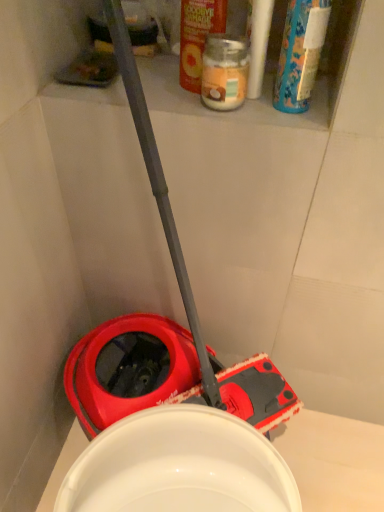
Question: From a real-world perspective, is blue plastic bottle at upper right, positioned as the second cleaning product in left-to-right order, physically located above or below orange matte jar at upper center, the 2th cleaning product viewed from the right?

Choices:
 (A) above
 (B) below

Answer: (A)

Question: Is blue plastic bottle at upper right, which is counted as the 1th cleaning product, starting from the right, situated inside orange matte jar at upper center, the 2th cleaning product viewed from the right, or outside?

Choices:
 (A) inside
 (B) outside

Answer: (B)

Question: Which of these objects is positioned farthest from the blue plastic bottle at upper right, which is counted as the 1th cleaning product, starting from the right?

Choices:
 (A) translucent glass jar at upper center
 (B) orange matte jar at upper center, which is the 1th cleaning product from left to right

Answer: (B)

Question: Based on their relative distances, which object is nearer to the orange matte jar at upper center, which is the 1th cleaning product from left to right?

Choices:
 (A) translucent glass jar at upper center
 (B) blue plastic bottle at upper right, which is counted as the 1th cleaning product, starting from the right

Answer: (A)